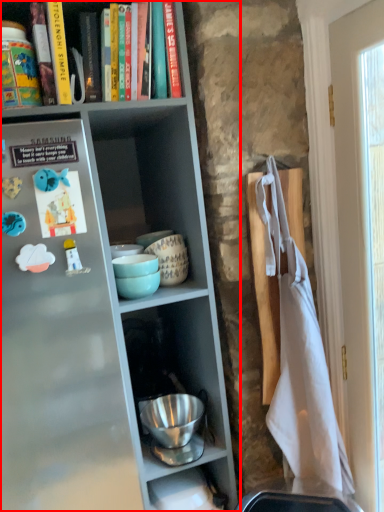
Question: From the image's perspective, where is shelf (annotated by the red box) located relative to book?

Choices:
 (A) above
 (B) below

Answer: (B)